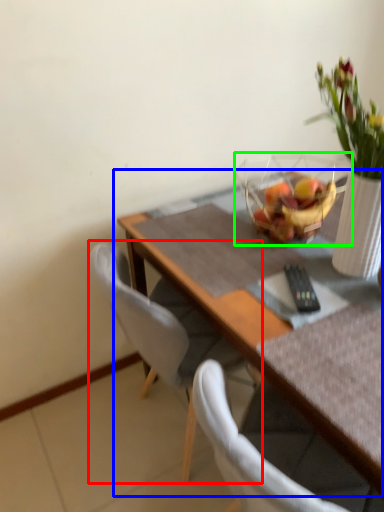
Question: Which object is positioned farthest from chair (highlighted by a red box)? Select from table (highlighted by a blue box) and basket (highlighted by a green box).

Choices:
 (A) table
 (B) basket

Answer: (B)